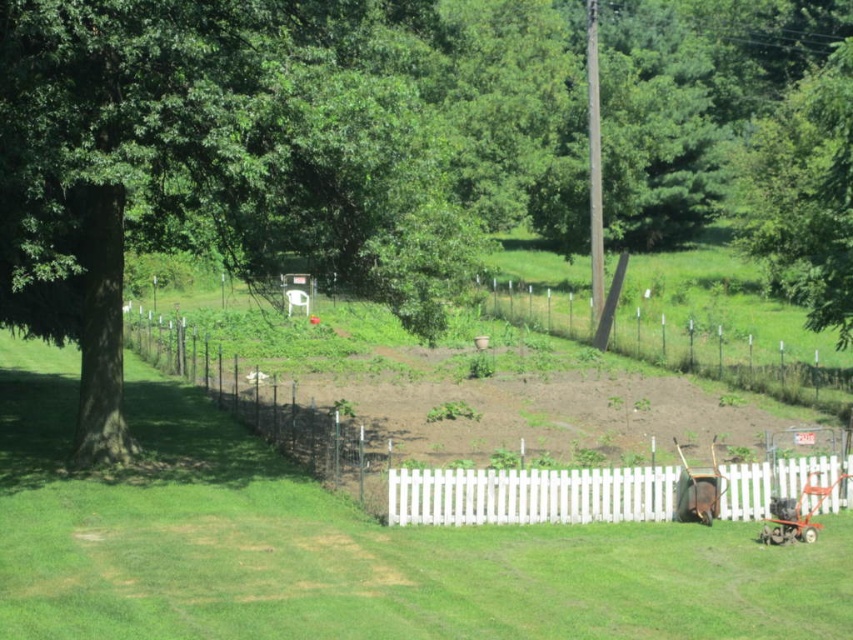
You are a parent wanting to place a metallic red baby carriage at lower right in the garden without blocking the sunlight for the green leafy tree at upper left. Can you do that?

The green leafy tree at upper left is taller than the metallic red baby carriage at lower right. Since the tree is taller, placing the metallic red baby carriage at lower right in the garden won